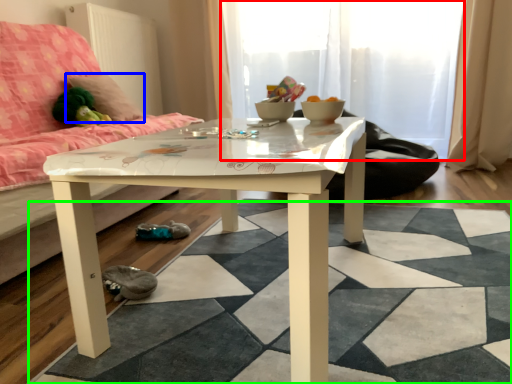
Question: Which object is the closest to the glass door (highlighted by a red box)? Choose among these: pillow (highlighted by a blue box) or square (highlighted by a green box).

Choices:
 (A) pillow
 (B) square

Answer: (A)